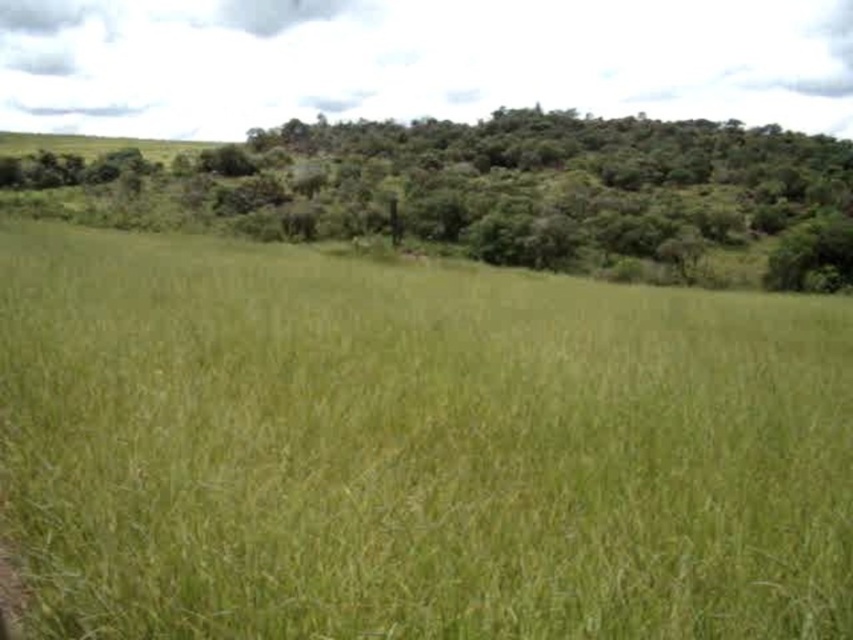
Is point (294, 339) less distant than point (751, 256)?

That is True.

Is green grassy field at center shorter than green leafy tree at upper center?

Yes, green grassy field at center is shorter than green leafy tree at upper center.

The width and height of the screenshot is (853, 640). What are the coordinates of `green grassy field at center` in the screenshot? It's located at (413, 448).